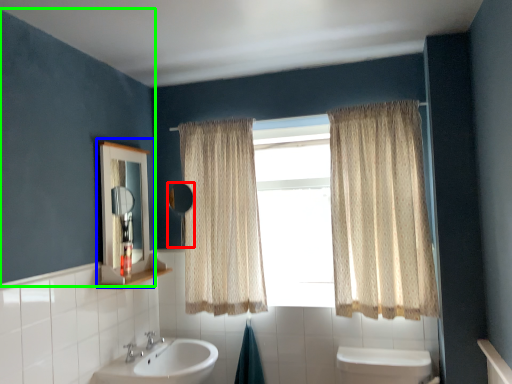
Question: Which is nearer to the mirror (highlighted by a red box)? medicine cabinet (highlighted by a blue box) or backdrop (highlighted by a green box).

Choices:
 (A) medicine cabinet
 (B) backdrop

Answer: (A)